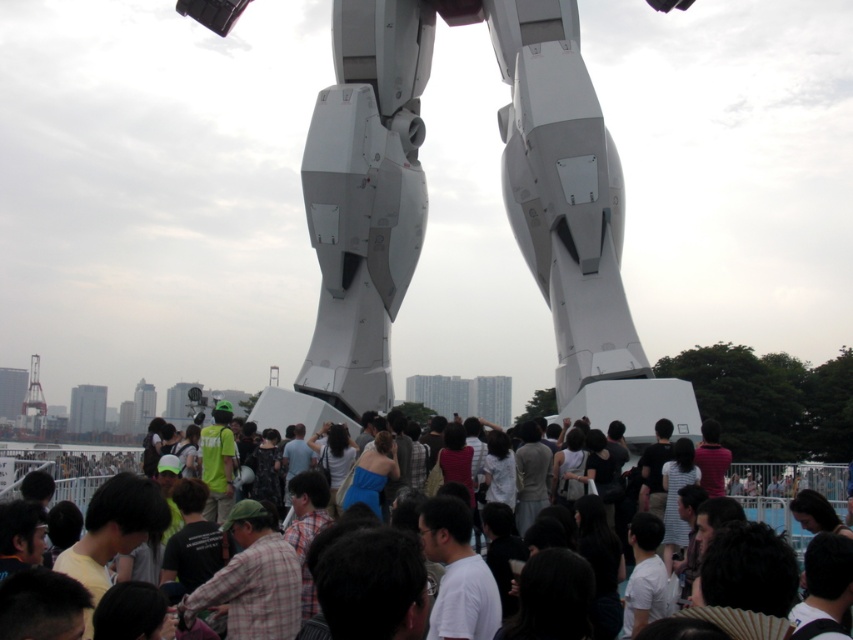
You are standing in front of the massive white robotic statue. There is a point at coordinates point (303, 161). Can you reach that point without moving your position?

The point at (303, 161) is 421.38 feet away from you, so you cannot reach it without moving your position.

You are standing in the crowd around the white matte robot legs at center. If you want to get a clear view of the robot legs, should you move towards the left or right side of the current position?

The white matte robot legs at center is located at point (503,202). Since the robot legs are at the center, moving either left or right might not necessarily provide a clearer view. However, considering the crowd is densely packed around the center, moving slightly to the right could help avoid the crowd and get a better angle. Alternatively, moving to the left might also work depending on the crowd density distribution, but without specific crowd density data, it is difficult to determine the optimal. A

You are a photographer trying to capture a photo of the white matte robot legs at center and the matte white crowd at center in the same frame. Based on their sizes, which one will appear larger in the photo?

The white matte robot legs at center will appear larger in the photo because it is bigger than the matte white crowd at center.